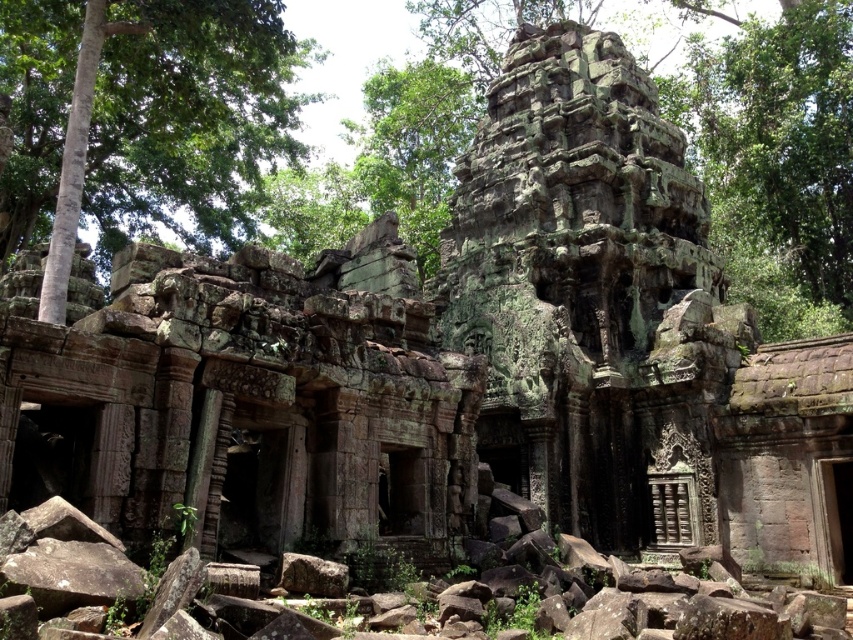
Question: Among these points, which one is farthest from the camera?

Choices:
 (A) (840, 200)
 (B) (96, 49)
 (C) (759, 272)

Answer: (A)

Question: Which point appears closest to the camera in this image?

Choices:
 (A) (111, 4)
 (B) (827, 221)
 (C) (834, 284)

Answer: (A)

Question: Can you confirm if green mossy tree at upper left is smaller than green mossy stone temple at center?

Choices:
 (A) no
 (B) yes

Answer: (B)

Question: Can you confirm if green mossy stone temple at center is wider than green mossy rock at upper center?

Choices:
 (A) yes
 (B) no

Answer: (A)

Question: Which point is farther from the camera taking this photo?

Choices:
 (A) (840, 200)
 (B) (99, 131)
 (C) (816, 93)

Answer: (A)

Question: Is green mossy tree at upper left further to camera compared to green mossy rock at upper center?

Choices:
 (A) no
 (B) yes

Answer: (A)